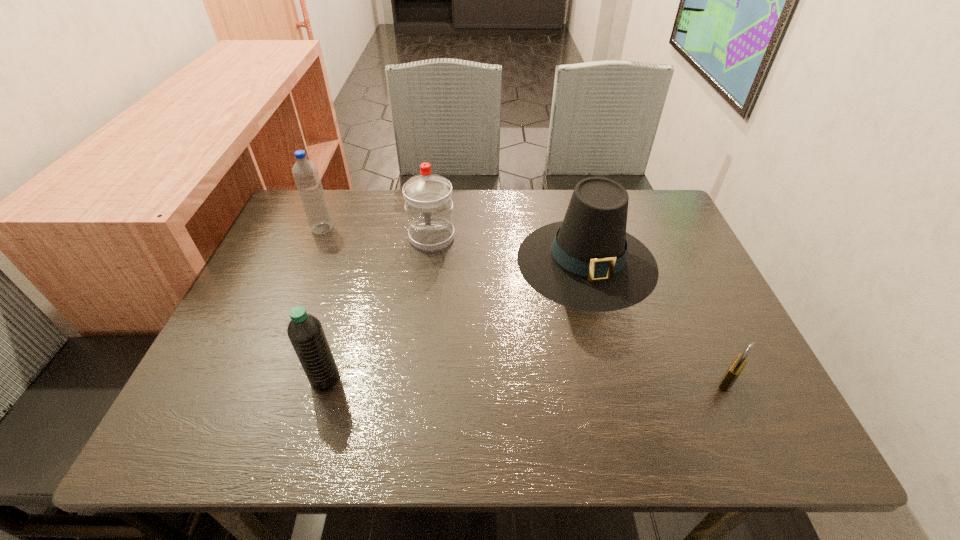
This screenshot has width=960, height=540. Find the location of `the leftmost object`. the leftmost object is located at coordinates (305, 172).

Locate an element on the screen. This screenshot has height=540, width=960. the third object from right to left is located at coordinates (428, 197).

This screenshot has height=540, width=960. I want to click on hat, so click(588, 261).

Locate an element on the screen. The width and height of the screenshot is (960, 540). the second water bottle from left to right is located at coordinates (305, 331).

The width and height of the screenshot is (960, 540). I want to click on the second object from left to right, so click(x=305, y=331).

You are a GUI agent. You are given a task and a screenshot of the screen. Output one action in this format:
    pyautogui.click(x=<x>, y=<y>)
    Task: Click on the rightmost object
    This screenshot has height=540, width=960.
    Given the screenshot: What is the action you would take?
    coord(738,364)

Locate an element on the screen. The width and height of the screenshot is (960, 540). padlock is located at coordinates [x=738, y=364].

This screenshot has width=960, height=540. Find the location of `free space located on the right of the leftmost object`. free space located on the right of the leftmost object is located at coordinates (455, 228).

Where is `free region located 0.270m on the handle side of the third object from right to left`? The height and width of the screenshot is (540, 960). free region located 0.270m on the handle side of the third object from right to left is located at coordinates (420, 332).

I want to click on blank area located on the front-facing side of the hat, so tap(604, 328).